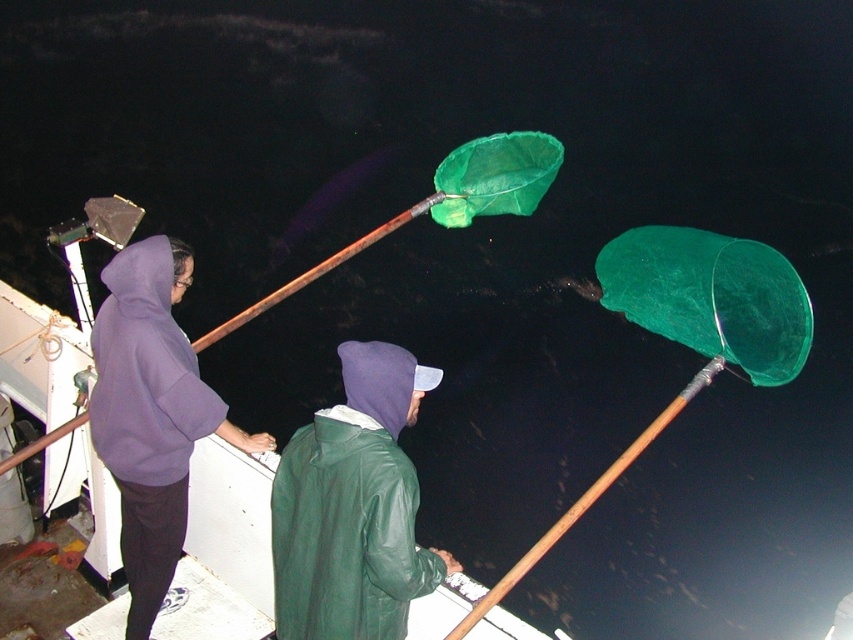
Question: Can you confirm if wooden pole at upper center is thinner than green fabric net at left?

Choices:
 (A) yes
 (B) no

Answer: (A)

Question: Which of these objects is positioned farthest from the green matte jacket at center?

Choices:
 (A) wooden pole at upper center
 (B) green fabric net at left

Answer: (B)

Question: Which object is farther from the camera taking this photo?

Choices:
 (A) wooden pole at upper center
 (B) purple hoodie at left
 (C) green fabric net at left

Answer: (C)

Question: Does purple hoodie at left come in front of wooden pole at upper center?

Choices:
 (A) yes
 (B) no

Answer: (B)

Question: Which point appears closest to the camera in this image?

Choices:
 (A) (532, 550)
 (B) (422, 209)

Answer: (A)

Question: In this image, where is green matte jacket at center located relative to wooden pole at upper center?

Choices:
 (A) above
 (B) below

Answer: (A)